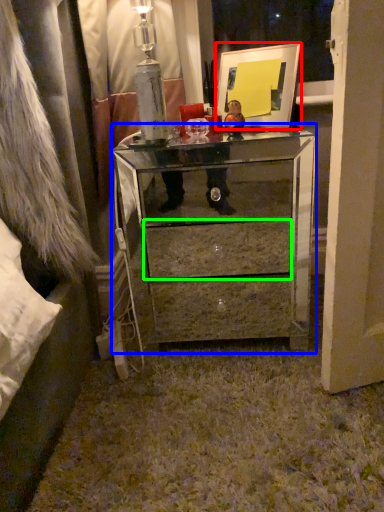
Question: Which is farther away from picture frame (highlighted by a red box)? chest of drawers (highlighted by a blue box) or drawer (highlighted by a green box)?

Choices:
 (A) chest of drawers
 (B) drawer

Answer: (B)